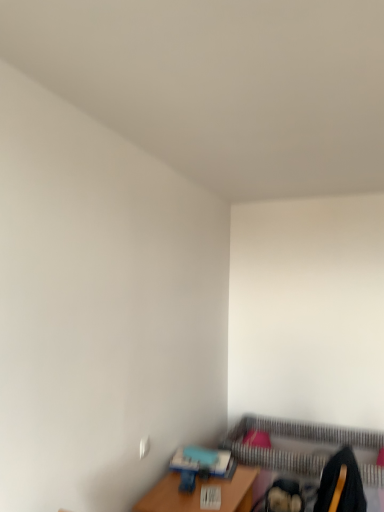
Image resolution: width=384 pixels, height=512 pixels. What do you see at coordinates (341, 485) in the screenshot?
I see `metallic gold swivel chair at lower right` at bounding box center [341, 485].

At what (x,y) coordinates should I click in order to perform the action: click on metallic gold swivel chair at lower right. Please return your answer as a coordinate pair (x, y). The width and height of the screenshot is (384, 512). Looking at the image, I should click on (341, 485).

Is metallic gold swivel chair at lower right facing towards wooden table at lower right?

Yes, metallic gold swivel chair at lower right faces towards wooden table at lower right.

Who is more distant, metallic gold swivel chair at lower right or wooden table at lower right?

wooden table at lower right is further away from the camera.

From the image's perspective, is metallic gold swivel chair at lower right beneath wooden table at lower right?

No.

Considering the sizes of objects metallic gold swivel chair at lower right and wooden table at lower right in the image provided, who is taller, metallic gold swivel chair at lower right or wooden table at lower right?

Standing taller between the two is metallic gold swivel chair at lower right.

Does striped fabric bed frame at lower right have a greater height compared to wooden table at lower right?

Indeed, striped fabric bed frame at lower right has a greater height compared to wooden table at lower right.

Considering the sizes of striped fabric bed frame at lower right and wooden table at lower right in the image, is striped fabric bed frame at lower right wider or thinner than wooden table at lower right?

Clearly, striped fabric bed frame at lower right has more width compared to wooden table at lower right.

How distant is striped fabric bed frame at lower right from wooden table at lower right?

striped fabric bed frame at lower right is 74.26 centimeters away from wooden table at lower right.

Which point is more distant from viewer, (286, 449) or (150, 508)?

The point (286, 449) is behind.

From the image's perspective, which one is positioned lower, wooden table at lower right or metallic gold swivel chair at lower right?

wooden table at lower right is shown below in the image.

Which object is closer to the camera, wooden table at lower right or metallic gold swivel chair at lower right?

metallic gold swivel chair at lower right is more forward.

Is wooden table at lower right with metallic gold swivel chair at lower right?

There is a gap between wooden table at lower right and metallic gold swivel chair at lower right.

From the image's perspective, who appears lower, metallic gold swivel chair at lower right or striped fabric bed frame at lower right?

striped fabric bed frame at lower right is shown below in the image.

Is metallic gold swivel chair at lower right beside striped fabric bed frame at lower right?

No, metallic gold swivel chair at lower right is not beside striped fabric bed frame at lower right.

Is metallic gold swivel chair at lower right positioned with its back to striped fabric bed frame at lower right?

No, metallic gold swivel chair at lower right is not facing the opposite direction of striped fabric bed frame at lower right.

Can you confirm if metallic gold swivel chair at lower right is thinner than striped fabric bed frame at lower right?

Indeed, metallic gold swivel chair at lower right has a lesser width compared to striped fabric bed frame at lower right.

Based on the photo, from a real-world perspective, is striped fabric bed frame at lower right on top of metallic gold swivel chair at lower right?

Actually, striped fabric bed frame at lower right is physically below metallic gold swivel chair at lower right in the real world.

Is striped fabric bed frame at lower right located outside metallic gold swivel chair at lower right?

Yes.

Is striped fabric bed frame at lower right touching metallic gold swivel chair at lower right?

There is a gap between striped fabric bed frame at lower right and metallic gold swivel chair at lower right.

Considering the sizes of wooden table at lower right and striped fabric bed frame at lower right in the image, is wooden table at lower right bigger or smaller than striped fabric bed frame at lower right?

Considering their sizes, wooden table at lower right takes up less space than striped fabric bed frame at lower right.

In the scene shown: From the image's perspective, which one is positioned lower, wooden table at lower right or striped fabric bed frame at lower right?

striped fabric bed frame at lower right, from the image's perspective.

From a real-world perspective, is wooden table at lower right physically below striped fabric bed frame at lower right?

Actually, wooden table at lower right is physically above striped fabric bed frame at lower right in the real world.

Which is closer, [156,486] or [379,447]?

The point [156,486] is closer to the camera.

Identify the location of swivel chair that is above the wooden table at lower right (from a real-world perspective). (341, 485).

At what (x,y) coordinates should I click in order to perform the action: click on table in front of the striped fabric bed frame at lower right. Please return your answer as a coordinate pair (x, y). The height and width of the screenshot is (512, 384). Looking at the image, I should click on (200, 493).

Which object lies nearer to the anchor point metallic gold swivel chair at lower right, striped fabric bed frame at lower right or wooden table at lower right?

wooden table at lower right lies closer to metallic gold swivel chair at lower right than the other object.

When comparing their distances from striped fabric bed frame at lower right, does metallic gold swivel chair at lower right or wooden table at lower right seem closer?

Based on the image, wooden table at lower right appears to be nearer to striped fabric bed frame at lower right.

Which object lies further to the anchor point metallic gold swivel chair at lower right, wooden table at lower right or striped fabric bed frame at lower right?

striped fabric bed frame at lower right is positioned further to the anchor metallic gold swivel chair at lower right.

In the scene shown: When comparing their distances from wooden table at lower right, does striped fabric bed frame at lower right or metallic gold swivel chair at lower right seem further?

striped fabric bed frame at lower right.

Estimate the real-world distances between objects in this image. Which object is closer to wooden table at lower right, metallic gold swivel chair at lower right or striped fabric bed frame at lower right?

metallic gold swivel chair at lower right is positioned closer to the anchor wooden table at lower right.

Based on their spatial positions, is wooden table at lower right or metallic gold swivel chair at lower right further from striped fabric bed frame at lower right?

The object further to striped fabric bed frame at lower right is metallic gold swivel chair at lower right.

Identify the location of swivel chair situated between wooden table at lower right and striped fabric bed frame at lower right from left to right. (341, 485).